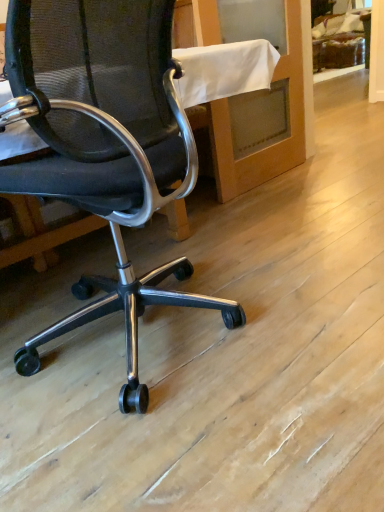
Locate an element on the screen. This screenshot has height=512, width=384. unoccupied area in front of matte black office chair at left is located at coordinates (185, 442).